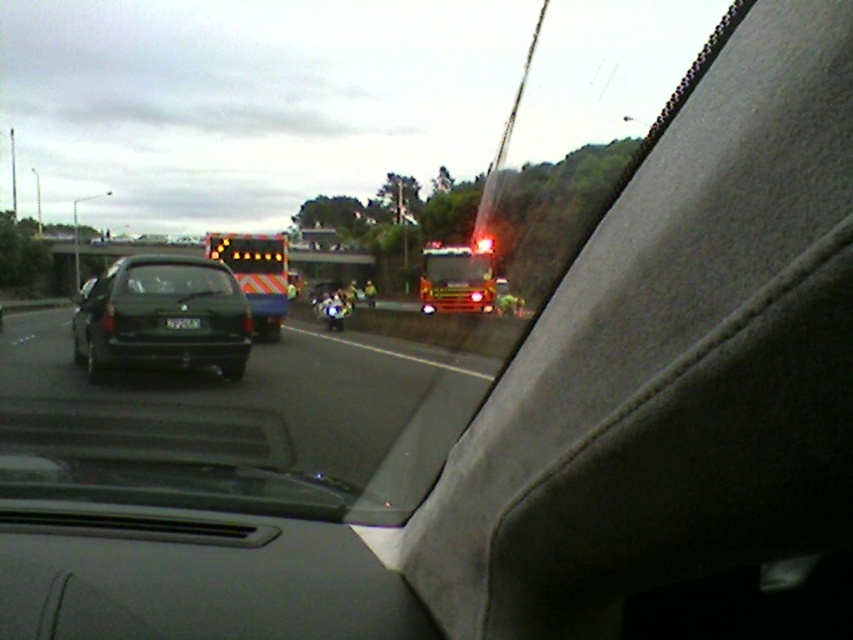
You are a passenger in a car and notice the shiny red fire truck at center and the black plastic license plate at center. Which object is closer to the front of the car?

The shiny red fire truck at center is located above the black plastic license plate at center, meaning it is closer to the front of the car.

You are a passenger in a car and notice two objects through the windshield. You see the shiny red fire truck at center and the black plastic license plate at center. Which object is closer to you?

The shiny red fire truck at center is closer to you than the black plastic license plate at center because it is further to the viewer.

You are a passenger in a car and looking out the window. You see a black glossy car at left and a reflective orange fire truck at center. Which vehicle is closer to your side of the road?

The black glossy car at left is closer to your side of the road because it is positioned to the right of the reflective orange fire truck at center, which would place it nearer to the passenger side where you are sitting.